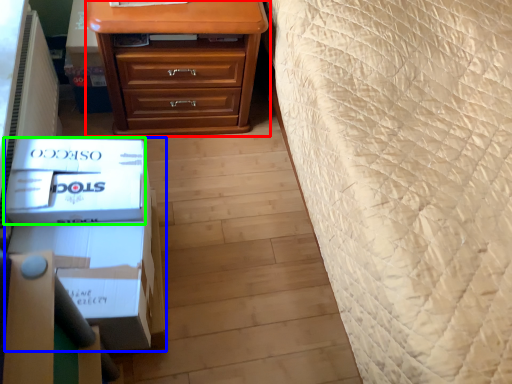
Question: Considering the real-world distances, which object is farthest from chest of drawers (highlighted by a red box)? box (highlighted by a blue box) or box (highlighted by a green box)?

Choices:
 (A) box
 (B) box

Answer: (A)